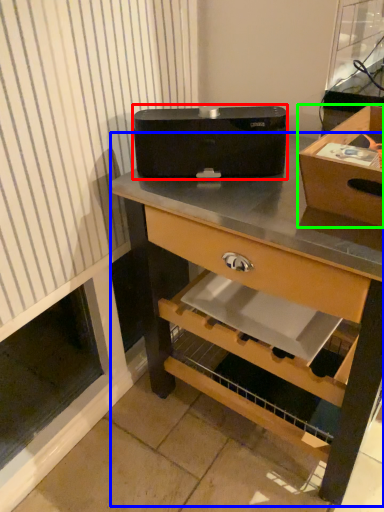
Question: Estimate the real-world distances between objects in this image. Which object is farther from appliance (highlighted by a red box), desk (highlighted by a blue box) or box (highlighted by a green box)?

Choices:
 (A) desk
 (B) box

Answer: (B)